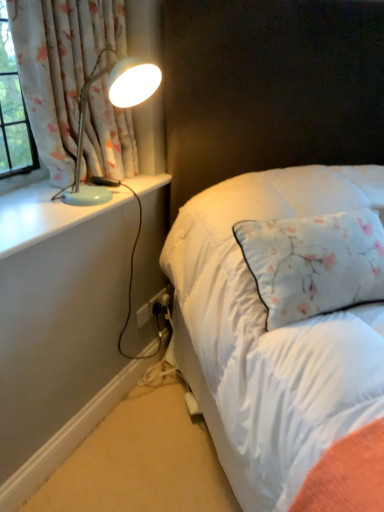
Question: Is black plastic electric outlet at lower center taller than white matte power strip at lower center?

Choices:
 (A) yes
 (B) no

Answer: (B)

Question: From the image's perspective, is black plastic electric outlet at lower center located above white matte power strip at lower center?

Choices:
 (A) no
 (B) yes

Answer: (B)

Question: From a real-world perspective, is black plastic electric outlet at lower center below white matte power strip at lower center?

Choices:
 (A) yes
 (B) no

Answer: (B)

Question: Is black plastic electric outlet at lower center directly adjacent to white matte power strip at lower center?

Choices:
 (A) no
 (B) yes

Answer: (A)

Question: Does black plastic electric outlet at lower center appear on the left side of white matte power strip at lower center?

Choices:
 (A) yes
 (B) no

Answer: (B)

Question: Looking at their shapes, would you say floral fabric curtain at upper left is wider or thinner than white matte power strip at lower center?

Choices:
 (A) thin
 (B) wide

Answer: (B)

Question: Is floral fabric curtain at upper left taller or shorter than white matte power strip at lower center?

Choices:
 (A) short
 (B) tall

Answer: (B)

Question: In the image, is floral fabric curtain at upper left on the left side or the right side of white matte power strip at lower center?

Choices:
 (A) left
 (B) right

Answer: (A)

Question: From a real-world perspective, is floral fabric curtain at upper left positioned above or below white matte power strip at lower center?

Choices:
 (A) above
 (B) below

Answer: (A)

Question: From a real-world perspective, is white matte power strip at lower center physically located above or below black plastic electric outlet at lower center?

Choices:
 (A) below
 (B) above

Answer: (A)

Question: In the image, is white matte power strip at lower center on the left side or the right side of black plastic electric outlet at lower center?

Choices:
 (A) right
 (B) left

Answer: (B)

Question: In terms of width, does white matte power strip at lower center look wider or thinner when compared to black plastic electric outlet at lower center?

Choices:
 (A) wide
 (B) thin

Answer: (A)

Question: Considering their positions, is white matte power strip at lower center located in front of or behind black plastic electric outlet at lower center?

Choices:
 (A) front
 (B) behind

Answer: (A)

Question: In terms of width, does white matte power strip at lower center look wider or thinner when compared to matte blue lamp at left?

Choices:
 (A) wide
 (B) thin

Answer: (B)

Question: Considering the positions of white matte power strip at lower center and matte blue lamp at left in the image, is white matte power strip at lower center bigger or smaller than matte blue lamp at left?

Choices:
 (A) big
 (B) small

Answer: (B)